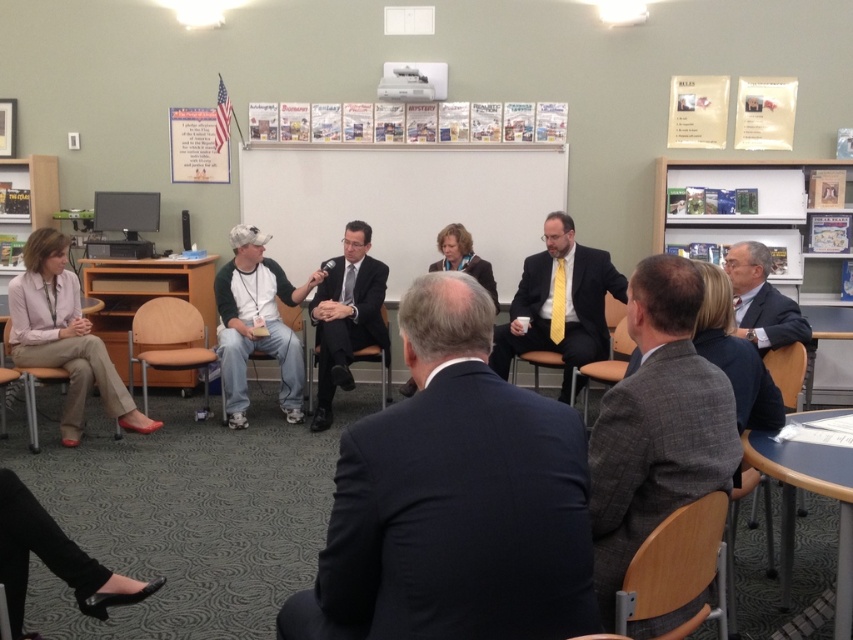
Does matte black suit at center lie in front of green and white baseball cap at lower left?

Yes, matte black suit at center is in front of green and white baseball cap at lower left.

Is matte black suit at center to the left of green and white baseball cap at lower left from the viewer's perspective?

No, matte black suit at center is not to the left of green and white baseball cap at lower left.

Which is in front, point (553, 321) or point (279, 390)?

Point (553, 321)

Image resolution: width=853 pixels, height=640 pixels. Find the location of `matte black suit at center`. matte black suit at center is located at coordinates (560, 304).

Locate an element on the screen. matte pink blouse at lower left is located at coordinates (64, 337).

Can you confirm if matte pink blouse at lower left is positioned to the left of brown padded chair at lower left?

Correct, you'll find matte pink blouse at lower left to the left of brown padded chair at lower left.

Find the location of a particular element. matte pink blouse at lower left is located at coordinates (64, 337).

Between matte pink blouse at lower left and dark blue suit at right, which one is positioned higher?

dark blue suit at right is above.

Is matte pink blouse at lower left taller than dark blue suit at right?

Indeed, matte pink blouse at lower left has a greater height compared to dark blue suit at right.

This screenshot has width=853, height=640. Find the location of `matte pink blouse at lower left`. matte pink blouse at lower left is located at coordinates (64, 337).

Where is `matte pink blouse at lower left`? matte pink blouse at lower left is located at coordinates (64, 337).